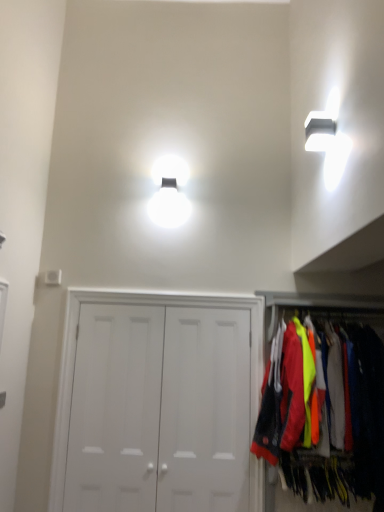
Question: Should I look upward or downward to see white matte door at center, the 2th door when ordered from right to left?

Choices:
 (A) up
 (B) down

Answer: (B)

Question: Considering the relative sizes of white matte door at center, marked as the third door in a left-to-right arrangement, and white matte door at center, the third door in the right-to-left sequence, in the image provided, is white matte door at center, marked as the third door in a left-to-right arrangement, bigger than white matte door at center, the third door in the right-to-left sequence,?

Choices:
 (A) no
 (B) yes

Answer: (A)

Question: Can you confirm if white matte door at center, which appears as the first door when viewed from the right, is thinner than white matte door at center, the third door in the right-to-left sequence?

Choices:
 (A) yes
 (B) no

Answer: (A)

Question: Is white matte door at center, which appears as the first door when viewed from the right, wider than white matte door at center, placed as the 1th door when sorted from left to right?

Choices:
 (A) no
 (B) yes

Answer: (A)

Question: From a real-world perspective, is white matte door at center, marked as the third door in a left-to-right arrangement, beneath white matte door at center, placed as the 1th door when sorted from left to right?

Choices:
 (A) no
 (B) yes

Answer: (A)

Question: Does white matte door at center, which appears as the first door when viewed from the right, have a lesser height compared to white matte door at center, the third door in the right-to-left sequence?

Choices:
 (A) no
 (B) yes

Answer: (B)

Question: Is white matte door at center, which appears as the first door when viewed from the right, far away from white matte door at center, the third door in the right-to-left sequence?

Choices:
 (A) yes
 (B) no

Answer: (B)

Question: Is white matte door at center, marked as the third door in a left-to-right arrangement, in contact with neon yellow fabric at right?

Choices:
 (A) no
 (B) yes

Answer: (A)

Question: Can you confirm if white matte door at center, marked as the third door in a left-to-right arrangement, is taller than neon yellow fabric at right?

Choices:
 (A) yes
 (B) no

Answer: (B)

Question: Does white matte door at center, which appears as the first door when viewed from the right, have a smaller size compared to neon yellow fabric at right?

Choices:
 (A) no
 (B) yes

Answer: (B)

Question: From a real-world perspective, is white matte door at center, marked as the third door in a left-to-right arrangement, over neon yellow fabric at right?

Choices:
 (A) no
 (B) yes

Answer: (A)

Question: Is white matte door at center, which appears as the first door when viewed from the right, facing away from neon yellow fabric at right?

Choices:
 (A) no
 (B) yes

Answer: (A)

Question: From a real-world perspective, is white matte door at center, marked as the third door in a left-to-right arrangement, positioned under neon yellow fabric at right based on gravity?

Choices:
 (A) yes
 (B) no

Answer: (A)

Question: From the image's perspective, is white matte door at center, which appears as the first door when viewed from the right, beneath white matte door at center, the 2th door when ordered from right to left?

Choices:
 (A) yes
 (B) no

Answer: (A)